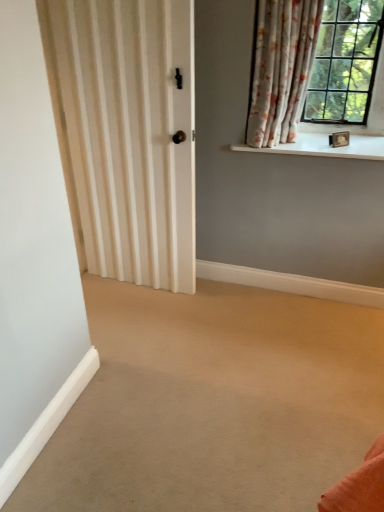
Question: Is floral fabric curtain at upper right at the right side of white smooth window sill at upper right?

Choices:
 (A) yes
 (B) no

Answer: (B)

Question: Is floral fabric curtain at upper right oriented towards white smooth window sill at upper right?

Choices:
 (A) no
 (B) yes

Answer: (A)

Question: Is floral fabric curtain at upper right at the left side of white smooth window sill at upper right?

Choices:
 (A) yes
 (B) no

Answer: (A)

Question: Is floral fabric curtain at upper right looking in the opposite direction of white smooth window sill at upper right?

Choices:
 (A) no
 (B) yes

Answer: (A)

Question: Can you confirm if floral fabric curtain at upper right is shorter than white smooth window sill at upper right?

Choices:
 (A) no
 (B) yes

Answer: (A)

Question: Considering the relative positions of floral fabric curtain at upper right and white smooth window sill at upper right in the image provided, is floral fabric curtain at upper right behind white smooth window sill at upper right?

Choices:
 (A) no
 (B) yes

Answer: (A)

Question: Can you confirm if white smooth window sill at upper right is positioned to the left of floral fabric curtain at upper right?

Choices:
 (A) no
 (B) yes

Answer: (A)

Question: Is the position of white smooth window sill at upper right less distant than that of floral fabric curtain at upper right?

Choices:
 (A) no
 (B) yes

Answer: (A)

Question: Would you say white smooth window sill at upper right contains floral fabric curtain at upper right?

Choices:
 (A) no
 (B) yes

Answer: (A)

Question: Is white smooth window sill at upper right positioned with its back to floral fabric curtain at upper right?

Choices:
 (A) yes
 (B) no

Answer: (B)

Question: Considering the relative sizes of white smooth window sill at upper right and floral fabric curtain at upper right in the image provided, is white smooth window sill at upper right bigger than floral fabric curtain at upper right?

Choices:
 (A) yes
 (B) no

Answer: (B)

Question: Is white smooth window sill at upper right further to the viewer compared to floral fabric curtain at upper right?

Choices:
 (A) no
 (B) yes

Answer: (B)

Question: From a real-world perspective, relative to floral fabric curtain at upper right, is white smooth window sill at upper right vertically above or below?

Choices:
 (A) above
 (B) below

Answer: (B)